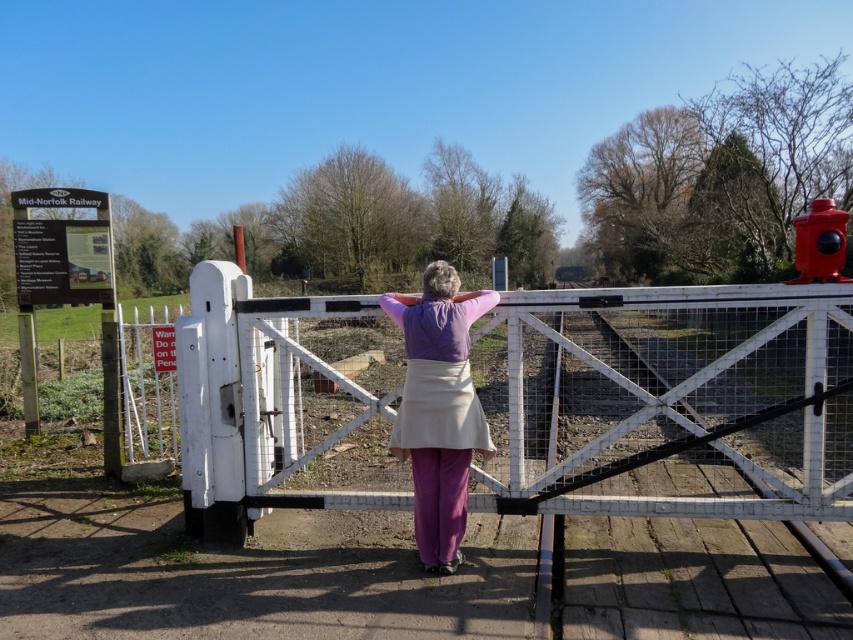
You are a photographer positioned at the railway crossing and want to capture both the purple matte shirt at center and the shiny red hydrant at upper right in a single photo. Which object will appear larger in the photo?

The purple matte shirt at center will appear larger in the photo because it is closer to the photographer than the shiny red hydrant at upper right.